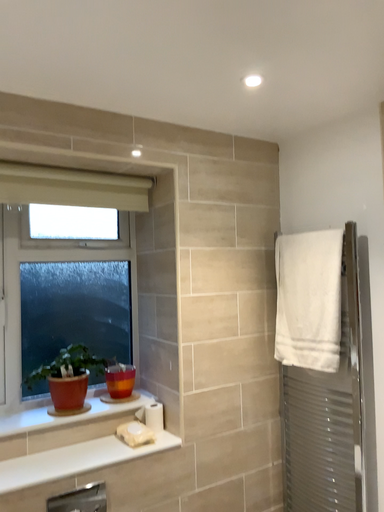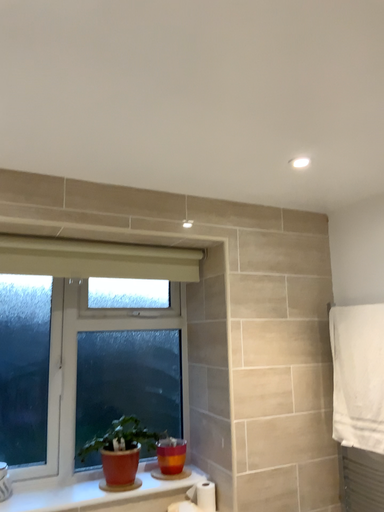
Question: How did the camera likely rotate when shooting the video?

Choices:
 (A) rotated left
 (B) rotated right

Answer: (A)